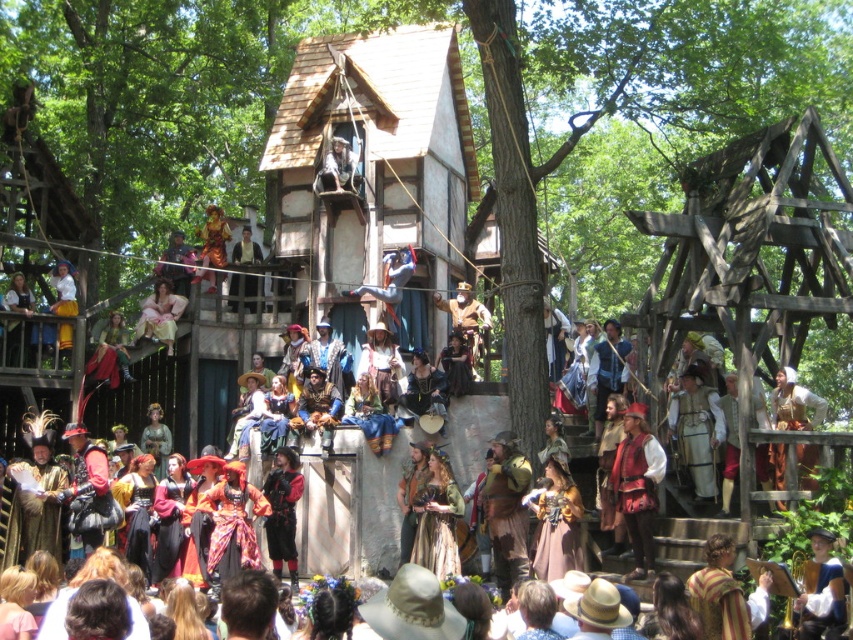
Question: Which of the following is the closest to the observer?

Choices:
 (A) matte black hat at upper left
 (B) green velvet dress at center
 (C) golden fabric dress at center

Answer: (C)

Question: In this image, where is golden fabric dress at center located relative to smooth leather glove at upper center?

Choices:
 (A) above
 (B) below

Answer: (B)

Question: Which object appears closest to the camera in this image?

Choices:
 (A) matte black vest at center
 (B) brown leather vest at center
 (C) light brown leather vest at center
 (D) shiny gold armor at upper center

Answer: (B)

Question: Is golden fabric dress at center smaller than smooth leather glove at upper center?

Choices:
 (A) no
 (B) yes

Answer: (B)

Question: Is brown leather vest at center bigger than gold textured fabric at center?

Choices:
 (A) no
 (B) yes

Answer: (B)

Question: Estimate the real-world distances between objects in this image. Which object is closer to the brown leather vest at center?

Choices:
 (A) blue velvet hat at center
 (B) matte black hat at upper left
 (C) light brown leather vest at center
 (D) shiny gold armor at upper center

Answer: (C)